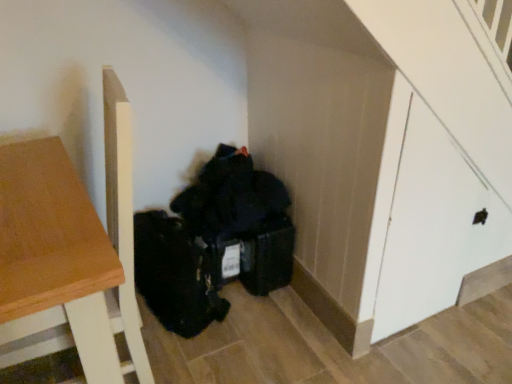
Question: Should I look upward or downward to see white matte door at right?

Choices:
 (A) down
 (B) up

Answer: (A)

Question: Does wooden table at left lie behind white matte door at right?

Choices:
 (A) no
 (B) yes

Answer: (A)

Question: From the image's perspective, is wooden table at left above white matte door at right?

Choices:
 (A) yes
 (B) no

Answer: (B)

Question: Is wooden table at left turned away from white matte door at right?

Choices:
 (A) yes
 (B) no

Answer: (B)

Question: Can we say wooden table at left lies outside white matte door at right?

Choices:
 (A) no
 (B) yes

Answer: (B)

Question: Does wooden table at left have a larger size compared to white matte door at right?

Choices:
 (A) yes
 (B) no

Answer: (A)

Question: Considering the relative sizes of wooden table at left and white matte door at right in the image provided, is wooden table at left smaller than white matte door at right?

Choices:
 (A) no
 (B) yes

Answer: (A)

Question: Is white matte door at right located outside wooden table at left?

Choices:
 (A) yes
 (B) no

Answer: (A)

Question: Is white matte door at right further to camera compared to wooden table at left?

Choices:
 (A) yes
 (B) no

Answer: (A)

Question: Is white matte door at right bigger than wooden table at left?

Choices:
 (A) yes
 (B) no

Answer: (B)

Question: From the image's perspective, is white matte door at right below wooden table at left?

Choices:
 (A) no
 (B) yes

Answer: (A)

Question: From a real-world perspective, does white matte door at right sit lower than wooden table at left?

Choices:
 (A) no
 (B) yes

Answer: (A)

Question: Is white matte door at right to the left of wooden table at left from the viewer's perspective?

Choices:
 (A) yes
 (B) no

Answer: (B)

Question: Considering the positions of point (81, 276) and point (414, 99), is point (81, 276) closer or farther from the camera than point (414, 99)?

Choices:
 (A) closer
 (B) farther

Answer: (A)